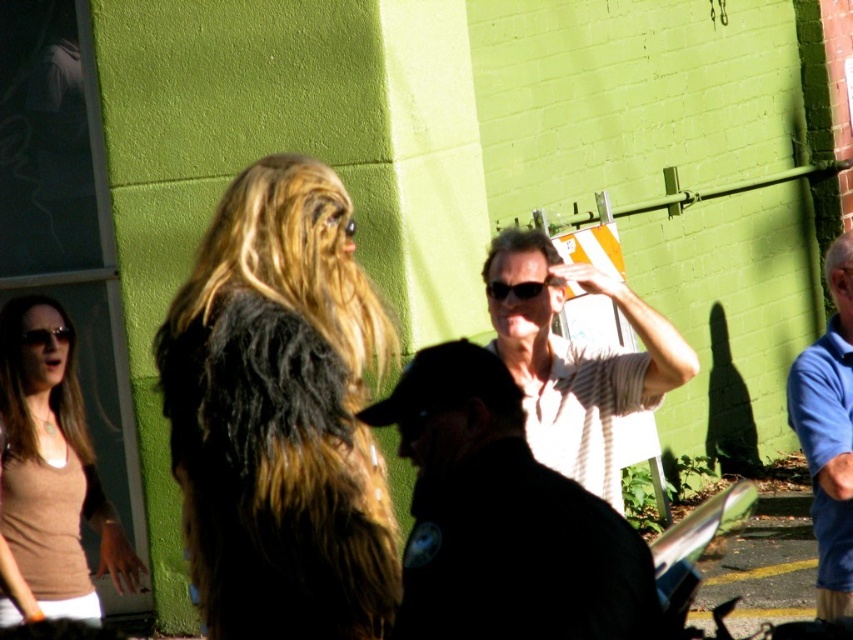
Is blonde silky hair at lower left to the left of gray fuzzy hair at upper right from the viewer's perspective?

Yes, blonde silky hair at lower left is to the left of gray fuzzy hair at upper right.

Based on the photo, can you confirm if blonde silky hair at lower left is positioned to the right of gray fuzzy hair at upper right?

Incorrect, blonde silky hair at lower left is not on the right side of gray fuzzy hair at upper right.

Describe the element at coordinates (28, 378) in the screenshot. The image size is (853, 640). I see `blonde silky hair at lower left` at that location.

Where is `blonde silky hair at lower left`? blonde silky hair at lower left is located at coordinates (28, 378).

Can you confirm if striped cotton shirt at center is positioned above black plastic goggles at upper left?

No, striped cotton shirt at center is not above black plastic goggles at upper left.

Can you confirm if striped cotton shirt at center is positioned below black plastic goggles at upper left?

Yes.

Find the location of a particular element. The image size is (853, 640). striped cotton shirt at center is located at coordinates (502, 518).

Can you confirm if gray fuzzy hair at upper right is wider than black plastic sunglasses at center?

Incorrect, gray fuzzy hair at upper right's width does not surpass black plastic sunglasses at center's.

Is gray fuzzy hair at upper right above black plastic sunglasses at center?

Yes.

At what (x,y) coordinates should I click in order to perform the action: click on gray fuzzy hair at upper right. Please return your answer as a coordinate pair (x, y). Looking at the image, I should click on (839, 262).